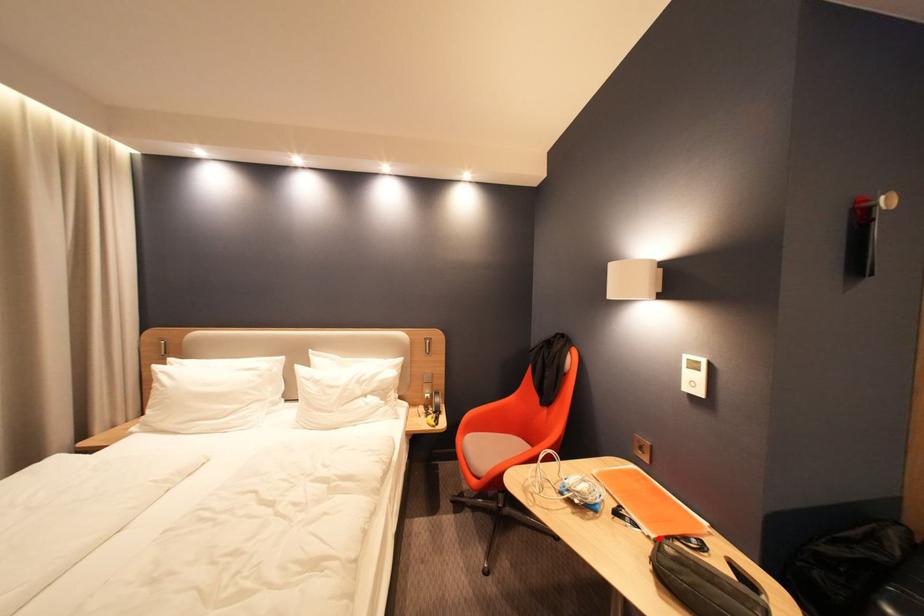
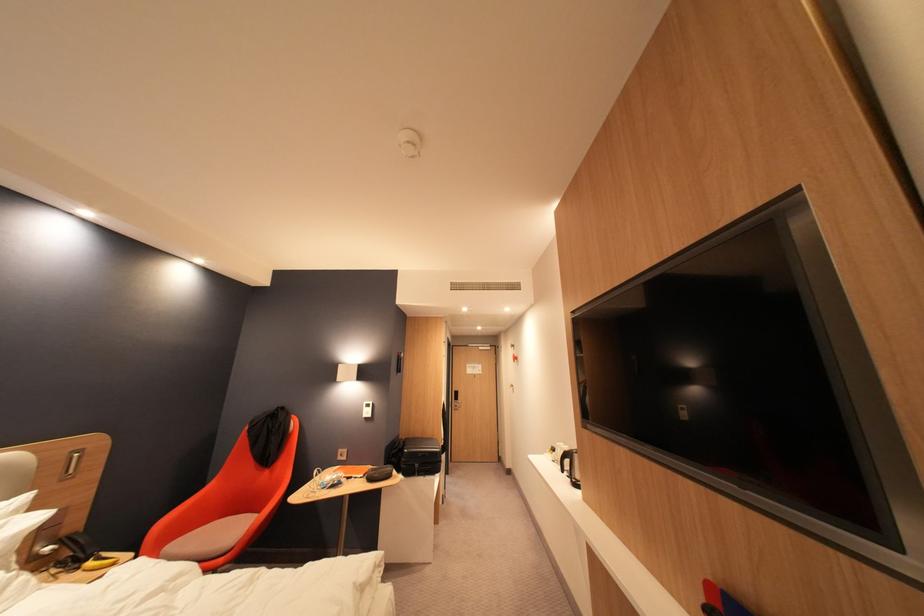
Question: A red point is marked in image1. In image2, is the corresponding 3D point closer to the camera or farther? Reply with the corresponding letter.

Choices:
 (A) The corresponding 3D point is closer.
 (B) The corresponding 3D point is farther.

Answer: (B)